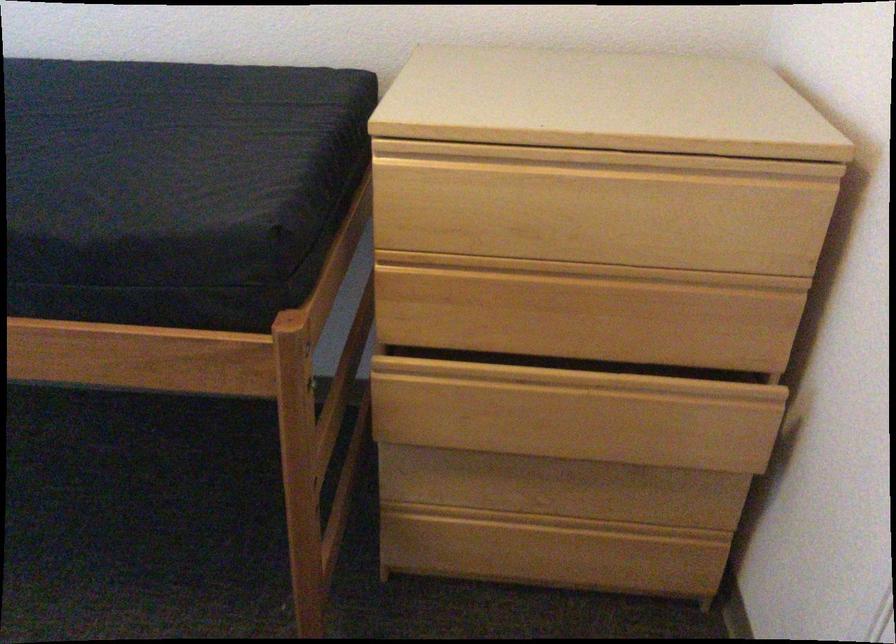
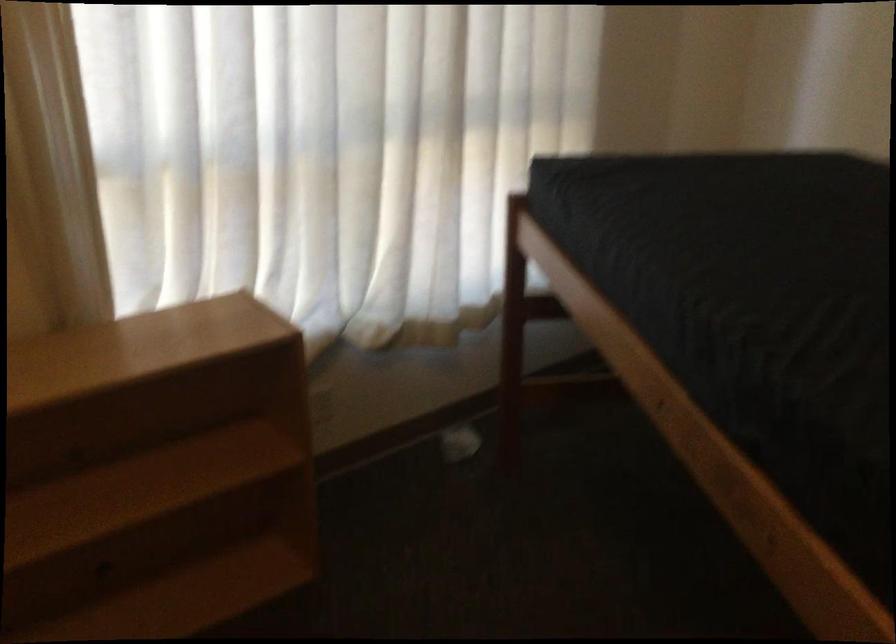
Question: The camera is either moving clockwise (left) or counter-clockwise (right) around the object. The first image is from the beginning of the video and the second image is from the end. Is the camera moving left or right when shooting the video?

Choices:
 (A) Left
 (B) Right

Answer: (B)